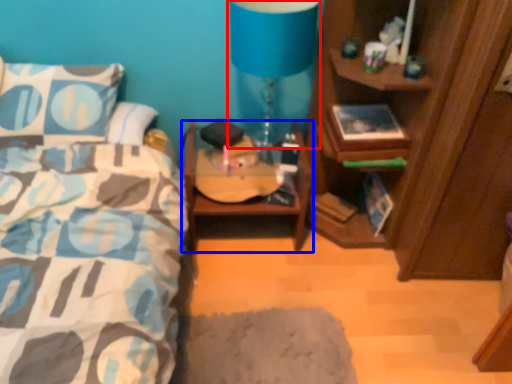
Question: Which of the following is the farthest to the observer, table lamp (highlighted by a red box) or nightstand (highlighted by a blue box)?

Choices:
 (A) table lamp
 (B) nightstand

Answer: (B)